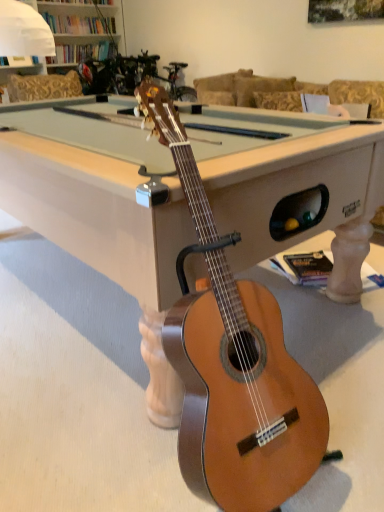
This screenshot has width=384, height=512. Identify the location of vacant space that is to the left of natural wood guitar at center. (93, 439).